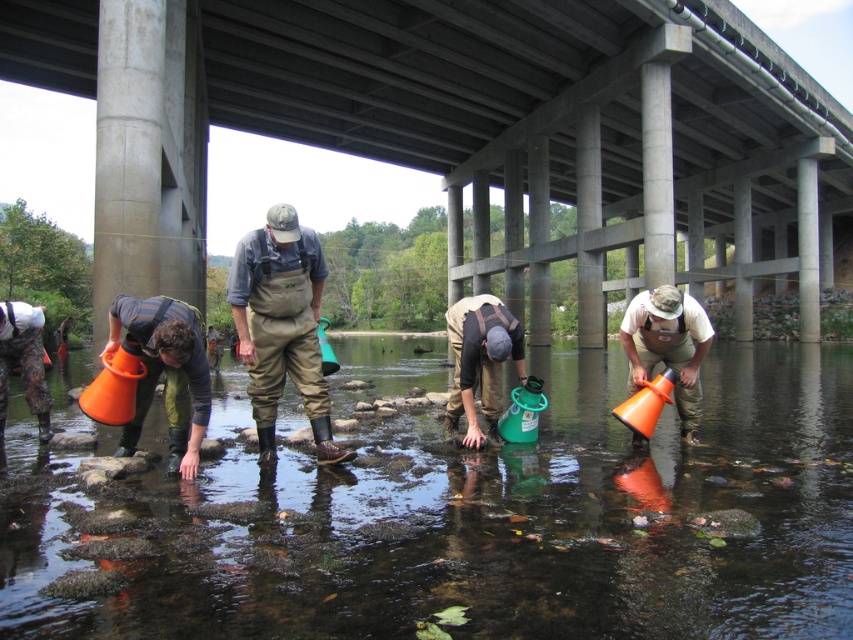
Is point (741, 83) closer to camera compared to point (134, 330)?

No, (741, 83) is further to viewer.

Between concrete bridge at center and orange plastic bucket at lower left, which one is positioned higher?

concrete bridge at center is higher up.

This screenshot has height=640, width=853. I want to click on concrete bridge at center, so click(466, 132).

Is matte orange cone at center right in front of camo pants at lower left?

Yes, it is.

Locate an element on the screen. The height and width of the screenshot is (640, 853). matte orange cone at center right is located at coordinates (668, 348).

Between point (677, 356) and point (38, 416), which one is positioned behind?

Positioned behind is point (38, 416).

At what (x,y) coordinates should I click in order to perform the action: click on matte orange cone at center right. Please return your answer as a coordinate pair (x, y). The height and width of the screenshot is (640, 853). Looking at the image, I should click on (668, 348).

Between orange plastic bucket at center and concrete bridge at center, which one appears on the left side from the viewer's perspective?

From the viewer's perspective, orange plastic bucket at center appears more on the left side.

Does orange plastic bucket at center come in front of concrete bridge at center?

Yes, it is in front of concrete bridge at center.

Find the location of a particular element. orange plastic bucket at center is located at coordinates (466, 522).